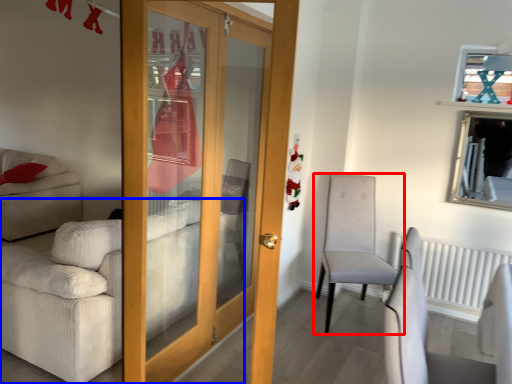
Question: Which object appears closest to the camera in this image, chair (highlighted by a red box) or studio couch (highlighted by a blue box)?

Choices:
 (A) chair
 (B) studio couch

Answer: (B)